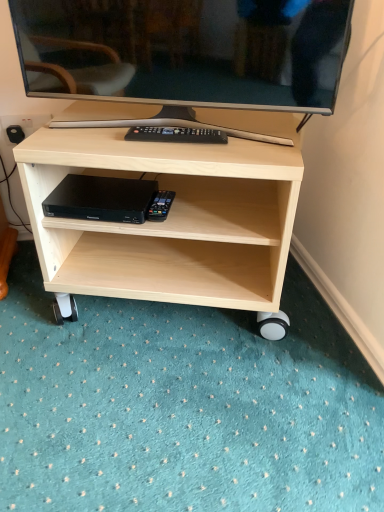
Question: Is black plastic dvd player at lower center taller or shorter than matte black television at upper center?

Choices:
 (A) short
 (B) tall

Answer: (A)

Question: Based on their positions, is black plastic dvd player at lower center located to the left or right of matte black television at upper center?

Choices:
 (A) right
 (B) left

Answer: (B)

Question: Estimate the real-world distances between objects in this image. Which object is farther from the light wood shelf at center?

Choices:
 (A) black plastic dvd player at lower center
 (B) matte black television at upper center

Answer: (B)

Question: Estimate the real-world distances between objects in this image. Which object is farther from the matte black television at upper center?

Choices:
 (A) black plastic dvd player at lower center
 (B) light wood shelf at center

Answer: (A)